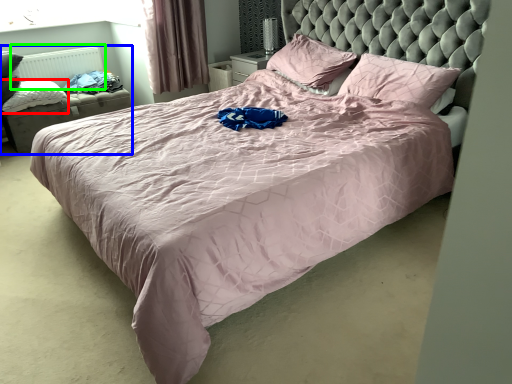
Question: Which is farther away from pillow (highlighted by a red box)? bed frame (highlighted by a blue box) or radiator (highlighted by a green box)?

Choices:
 (A) bed frame
 (B) radiator

Answer: (B)